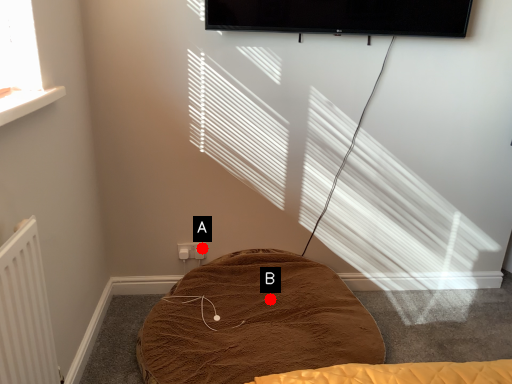
Question: Two points are circled on the image, labeled by A and B beside each circle. Which point is closer to the camera?

Choices:
 (A) A is closer
 (B) B is closer

Answer: (B)